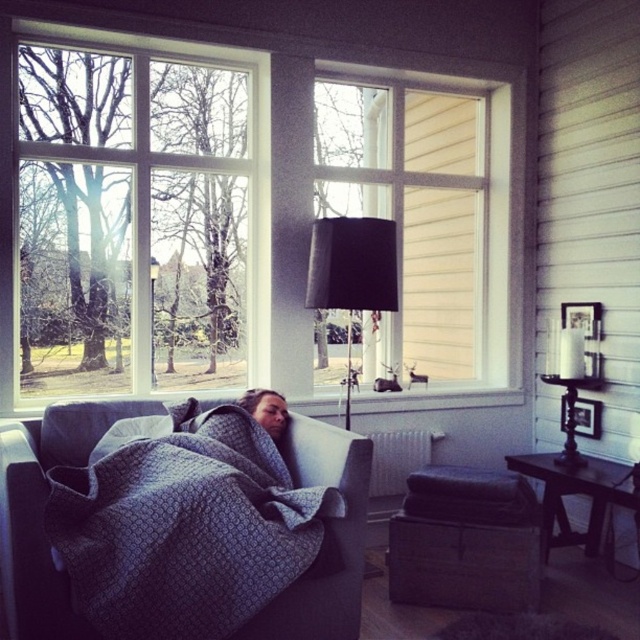
Question: Which object is the closest to the white matte radiator at center?

Choices:
 (A) clear glass window at upper left
 (B) black fabric lampshade at center

Answer: (B)

Question: Which of these objects is positioned farthest from the black fabric lampshade at center?

Choices:
 (A) matte white window at center
 (B) dark gray quilted blanket at center
 (C) clear glass window at upper left

Answer: (B)

Question: Does clear glass window at upper left come behind white matte radiator at center?

Choices:
 (A) yes
 (B) no

Answer: (B)

Question: Which object is farther from the camera taking this photo?

Choices:
 (A) matte white window at center
 (B) dark gray quilted blanket at center
 (C) white matte radiator at center
 (D) clear glass window at upper left

Answer: (A)

Question: Does clear glass window at upper left appear over matte white window at center?

Choices:
 (A) yes
 (B) no

Answer: (B)

Question: Is clear glass window at upper left positioned behind matte white window at center?

Choices:
 (A) yes
 (B) no

Answer: (B)